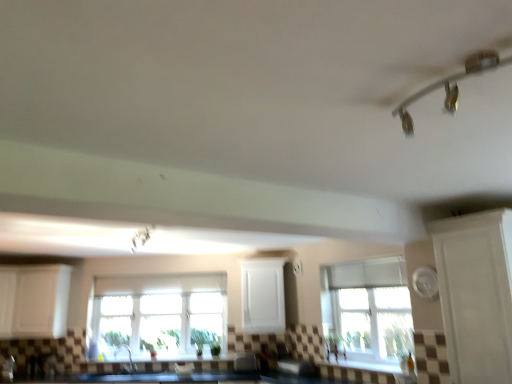
Locate an element on the screen. white metallic track lighting at upper right, the 1th light fixture in the front-to-back sequence is located at coordinates (449, 86).

What is the approximate height of metallic white light fixture at upper center, arranged as the first light fixture when ordered from the bottom?

metallic white light fixture at upper center, arranged as the first light fixture when ordered from the bottom, is 5.54 inches tall.

The height and width of the screenshot is (384, 512). What do you see at coordinates (245, 362) in the screenshot? I see `matte gray toaster at lower center` at bounding box center [245, 362].

Describe the element at coordinates (368, 309) in the screenshot. I see `white textured window at center, the first window positioned from the front` at that location.

The width and height of the screenshot is (512, 384). Describe the element at coordinates (263, 296) in the screenshot. I see `white matte cabinet at center, the 3th cabinetry from the left` at that location.

The width and height of the screenshot is (512, 384). In order to click on white metallic track lighting at upper right, which is the 2th light fixture from back to front in this screenshot , I will do `click(449, 86)`.

Is white metallic track lighting at upper right, which is the 2th light fixture from back to front, to the left of clear glass window at center, the first window viewed from the back, from the viewer's perspective?

No.

From a real-world perspective, is white metallic track lighting at upper right, placed as the 2th light fixture when sorted from bottom to top, on clear glass window at center, the first window viewed from the back?

Yes, from a real-world perspective, white metallic track lighting at upper right, placed as the 2th light fixture when sorted from bottom to top, is above clear glass window at center, the first window viewed from the back.

Between white metallic track lighting at upper right, the first light fixture positioned from the right, and clear glass window at center, placed as the first window when sorted from left to right, which one is positioned behind?

clear glass window at center, placed as the first window when sorted from left to right, is more distant.

Between clear glass window at center, the 2th window when ordered from front to back, and white metallic track lighting at upper right, the first light fixture positioned from the right, which one has smaller width?

Thinner between the two is clear glass window at center, the 2th window when ordered from front to back.

Is clear glass window at center, which is the 2th window from right to left, turned away from white metallic track lighting at upper right, the first light fixture positioned from the right?

clear glass window at center, which is the 2th window from right to left, is not turned away from white metallic track lighting at upper right, the first light fixture positioned from the right.

Is point (218, 301) positioned after point (418, 94)?

Yes, point (218, 301) is farther from viewer.

From a real-world perspective, is clear glass window at center, placed as the first window when sorted from left to right, physically located above or below white metallic track lighting at upper right, the first light fixture positioned from the right?

clear glass window at center, placed as the first window when sorted from left to right, is below white metallic track lighting at upper right, the first light fixture positioned from the right.

Is matte gray toaster at lower center taller than white metallic track lighting at upper right, the 2th light fixture from the left?

Correct, matte gray toaster at lower center is much taller as white metallic track lighting at upper right, the 2th light fixture from the left.

What are the coordinates of `the 2nd light fixture directly above the matte gray toaster at lower center (from a real-world perspective)` in the screenshot? It's located at (449, 86).

From a real-world perspective, does matte gray toaster at lower center sit lower than white metallic track lighting at upper right, arranged as the 1th light fixture when viewed from the top?

Yes, from a real-world perspective, matte gray toaster at lower center is below white metallic track lighting at upper right, arranged as the 1th light fixture when viewed from the top.

Considering the sizes of matte gray toaster at lower center and white textured window at center, marked as the 1th window in a right-to-left arrangement, in the image, is matte gray toaster at lower center wider or thinner than white textured window at center, marked as the 1th window in a right-to-left arrangement,?

In the image, matte gray toaster at lower center appears to be wider than white textured window at center, marked as the 1th window in a right-to-left arrangement.

How many degrees apart are the facing directions of matte gray toaster at lower center and white textured window at center, which is the second window in back-to-front order?

The angle between the facing direction of matte gray toaster at lower center and the facing direction of white textured window at center, which is the second window in back-to-front order, is 51.6 degrees.

The height and width of the screenshot is (384, 512). Find the location of `window on the right of matte gray toaster at lower center`. window on the right of matte gray toaster at lower center is located at coordinates (368, 309).

Is matte gray toaster at lower center looking in the opposite direction of white textured window at center, which is the second window in back-to-front order?

matte gray toaster at lower center is not turned away from white textured window at center, which is the second window in back-to-front order.

In the scene shown: Is the surface of matte gray toaster at lower center in direct contact with white matte cabinet at center, which is the first cabinetry in right-to-left order?

No.

Which object is further away from the camera taking this photo, matte gray toaster at lower center or white matte cabinet at center, which is the first cabinetry in right-to-left order?

white matte cabinet at center, which is the first cabinetry in right-to-left order, is further from the camera.

Considering the positions of objects matte gray toaster at lower center and white matte cabinet at center, which is the first cabinetry in right-to-left order, in the image provided, who is more to the left, matte gray toaster at lower center or white matte cabinet at center, which is the first cabinetry in right-to-left order,?

From the viewer's perspective, matte gray toaster at lower center appears more on the left side.

Is white matte cabinet at left, marked as the 2th cabinetry in a left-to-right arrangement, inside or outside of matte gray toaster at lower center?

white matte cabinet at left, marked as the 2th cabinetry in a left-to-right arrangement, is not enclosed by matte gray toaster at lower center.

From a real-world perspective, which object rests below the other?

In real-world perspective, matte gray toaster at lower center is lower.

Based on the photo, is the depth of white matte cabinet at left, marked as the 2th cabinetry in a left-to-right arrangement, less than that of matte gray toaster at lower center?

Yes, white matte cabinet at left, marked as the 2th cabinetry in a left-to-right arrangement, is closer to the viewer.

The height and width of the screenshot is (384, 512). What are the coordinates of `appliance on the right of silver metallic faucet at lower left` in the screenshot? It's located at (245, 362).

Which point is more forward, [242,370] or [132,365]?

The point [242,370] is closer to the camera.

From the image's perspective, which is above, matte gray toaster at lower center or silver metallic faucet at lower left?

matte gray toaster at lower center.

Is matte gray toaster at lower center at the right side of silver metallic faucet at lower left?

Yes.

From the image's perspective, count 2nd windows downward from the white metallic track lighting at upper right, which is the 2th light fixture from back to front, and point to it. Please provide its 2D coordinates.

[(159, 314)]

The width and height of the screenshot is (512, 384). I want to click on light fixture that is the 2nd object above the clear glass window at center, the first window viewed from the back (from a real-world perspective), so click(x=449, y=86).

From the image, which object appears to be farther from clear glass window at center, the 2th window when ordered from front to back, white glossy cabinet at right or white metallic track lighting at upper right, the 1th light fixture in the front-to-back sequence?

The object further to clear glass window at center, the 2th window when ordered from front to back, is white metallic track lighting at upper right, the 1th light fixture in the front-to-back sequence.

When comparing their distances from clear glass window at center, the 2th window when ordered from front to back, does silver metallic faucet at lower left or white matte cabinet at center, which is the first cabinetry in right-to-left order, seem closer?

silver metallic faucet at lower left is positioned closer to the anchor clear glass window at center, the 2th window when ordered from front to back.

From the image, which object appears to be farther from white matte cabinet at left, arranged as the 1th cabinetry when viewed from the left, matte gray toaster at lower center or metallic white light fixture at upper center, arranged as the first light fixture when ordered from the bottom?

matte gray toaster at lower center lies further to white matte cabinet at left, arranged as the 1th cabinetry when viewed from the left, than the other object.

Which object lies nearer to the anchor point white metallic track lighting at upper right, which is the 2th light fixture from back to front, clear glass window at center, which is the 2th window from right to left, or matte gray toaster at lower center?

matte gray toaster at lower center is closer to white metallic track lighting at upper right, which is the 2th light fixture from back to front.

From the image, which object appears to be nearer to white matte cabinet at left, marked as the 2th cabinetry in a left-to-right arrangement, white glossy cabinet at right or metallic white light fixture at upper center, which ranks as the 2th light fixture in right-to-left order?

metallic white light fixture at upper center, which ranks as the 2th light fixture in right-to-left order, lies closer to white matte cabinet at left, marked as the 2th cabinetry in a left-to-right arrangement, than the other object.

From the image, which object appears to be nearer to white textured window at center, the first window positioned from the front, silver metallic faucet at lower left or white metallic track lighting at upper right, the first light fixture positioned from the right?

white metallic track lighting at upper right, the first light fixture positioned from the right, lies closer to white textured window at center, the first window positioned from the front, than the other object.

Looking at the image, which one is located closer to matte gray toaster at lower center, white metallic track lighting at upper right, placed as the 2th light fixture when sorted from bottom to top, or white matte cabinet at center, the 3th cabinetry from the left?

Based on the image, white matte cabinet at center, the 3th cabinetry from the left, appears to be nearer to matte gray toaster at lower center.

Estimate the real-world distances between objects in this image. Which object is closer to white textured window at center, which is the second window in back-to-front order, white matte cabinet at left, which is the third cabinetry in right-to-left order, or clear glass window at center, placed as the first window when sorted from left to right?

Among the two, clear glass window at center, placed as the first window when sorted from left to right, is located nearer to white textured window at center, which is the second window in back-to-front order.

Locate an element on the screen. glass door positioned between white metallic track lighting at upper right, the 2th light fixture from the left, and white textured window at center, marked as the 1th window in a right-to-left arrangement, from near to far is located at coordinates (476, 294).

You are a GUI agent. You are given a task and a screenshot of the screen. Output one action in this format:
    pyautogui.click(x=<x>, y=<y>)
    Task: Click on the window between white matte cabinet at left, which is the 2th cabinetry in right-to-left order, and matte gray toaster at lower center, in the horizontal direction
    The image size is (512, 384).
    Given the screenshot: What is the action you would take?
    pyautogui.click(x=159, y=314)

Locate an element on the screen. light fixture between white matte cabinet at left, arranged as the 1th cabinetry when viewed from the left, and matte gray toaster at lower center, in the horizontal direction is located at coordinates (141, 238).

Locate an element on the screen. Image resolution: width=512 pixels, height=384 pixels. light fixture situated between white matte cabinet at left, which is the third cabinetry in right-to-left order, and white matte cabinet at center, the 3th cabinetry from the left, from left to right is located at coordinates (141, 238).